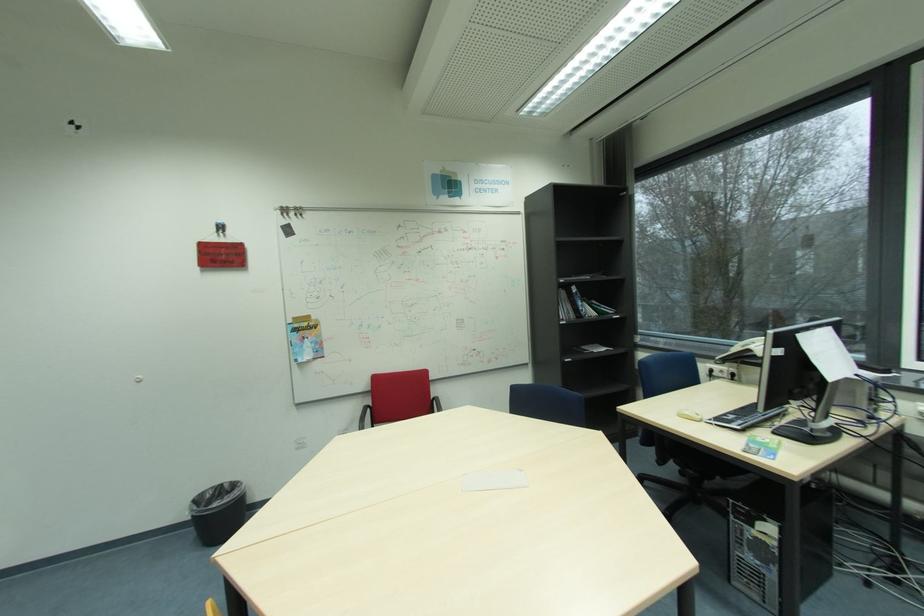
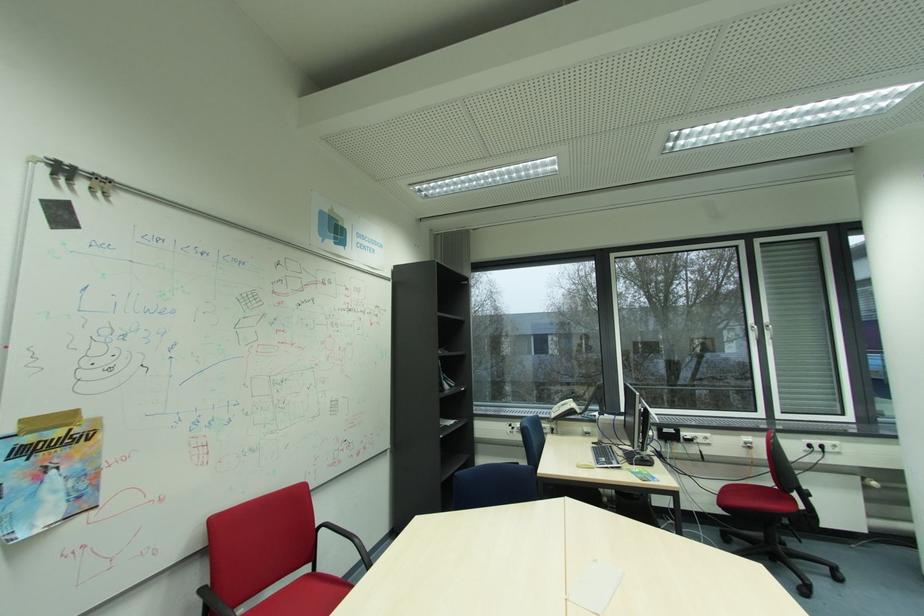
In the second image, find the point that corresponds to pixel 302 331 in the first image.

(31, 452)